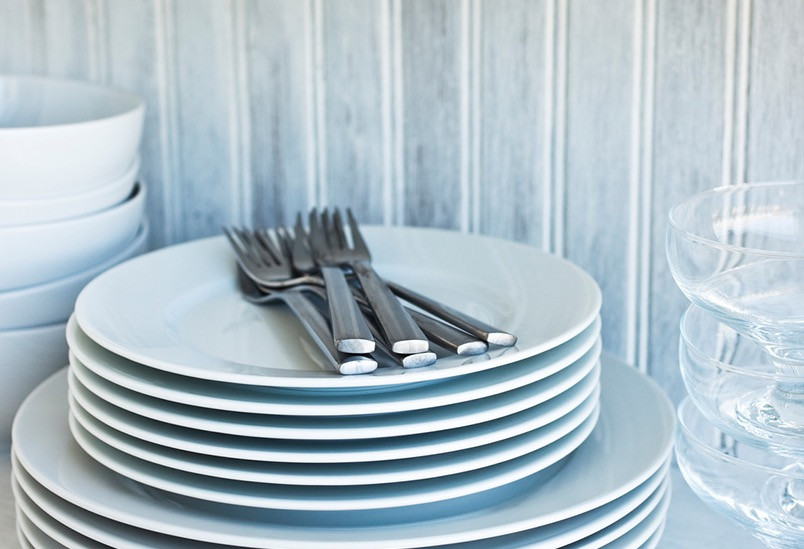
The width and height of the screenshot is (804, 549). Find the location of `bottom of utensil handles`. bottom of utensil handles is located at coordinates (361, 367), (363, 343), (405, 343), (421, 352), (469, 341), (501, 341).